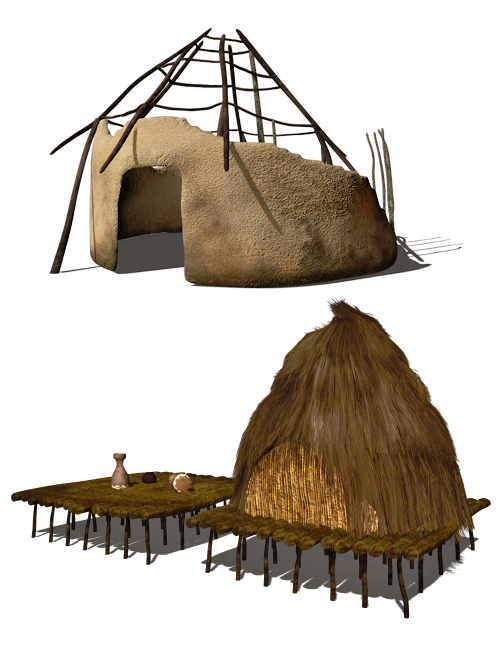
Where is `door gap`? This screenshot has width=500, height=650. door gap is located at coordinates (152, 231).